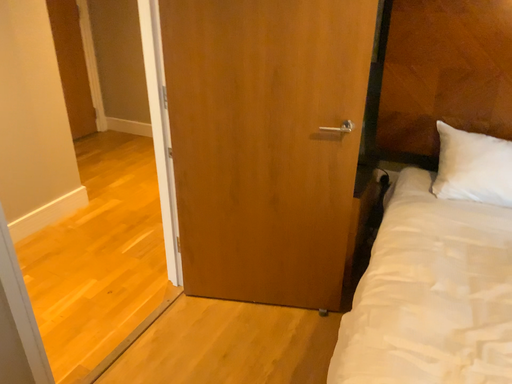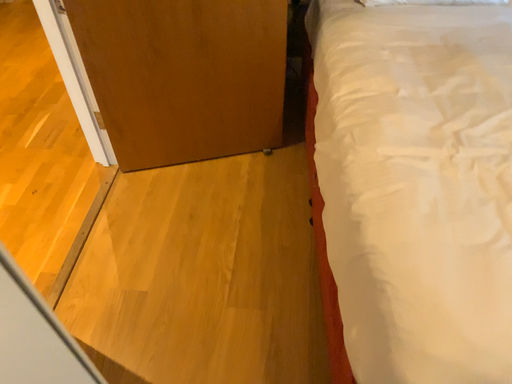
Question: How did the camera likely rotate when shooting the video?

Choices:
 (A) rotated downward
 (B) rotated upward

Answer: (A)